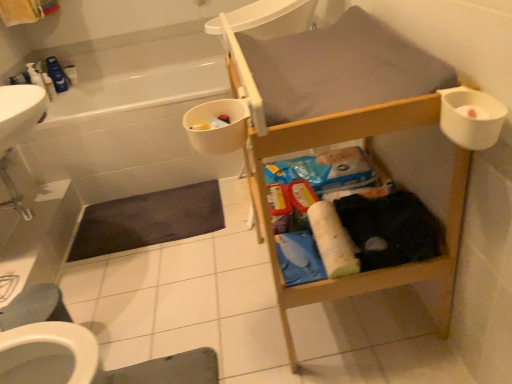
Find the location of a particular element. The height and width of the screenshot is (384, 512). gray fabric bath mat at lower center, which is the first bath mat in front-to-back order is located at coordinates (168, 370).

What do you see at coordinates (57, 74) in the screenshot?
I see `blue glossy bottle at upper left` at bounding box center [57, 74].

Where is `gray fabric bath mat at lower center, the 1th bath mat positioned from the bottom`? This screenshot has height=384, width=512. gray fabric bath mat at lower center, the 1th bath mat positioned from the bottom is located at coordinates (168, 370).

Which is behind, point (346, 241) or point (15, 343)?

Point (346, 241)

Is white matte toilet paper at center to the right of white plastic bidet at lower left from the viewer's perspective?

Indeed, white matte toilet paper at center is positioned on the right side of white plastic bidet at lower left.

Is white matte toilet paper at center smaller than white plastic bidet at lower left?

Yes.

Is white matte toilet paper at center positioned far away from white plastic bidet at lower left?

No, white matte toilet paper at center is in close proximity to white plastic bidet at lower left.

From a real-world perspective, is white plastic container at upper left, positioned as the 2th toiletry in right-to-left order, located beneath white matte toilet paper at center?

Actually, white plastic container at upper left, positioned as the 2th toiletry in right-to-left order, is physically above white matte toilet paper at center in the real world.

Between white plastic container at upper left, the third toiletry when ordered from bottom to top, and white matte toilet paper at center, which one appears on the right side from the viewer's perspective?

From the viewer's perspective, white matte toilet paper at center appears more on the right side.

Which point is more distant from viewer, (70, 77) or (344, 272)?

The point (70, 77) is behind.

In the image, there is a white plastic bidet at lower left. Identify the location of cleaning product above it (from the image's perspective). (57, 74).

Which is in front, point (97, 353) or point (51, 72)?

The point (97, 353) is more forward.

Is white plastic bidet at lower left far away from blue glossy bottle at upper left?

That's right, there is a large distance between white plastic bidet at lower left and blue glossy bottle at upper left.

Is white plastic bidet at lower left far from white plastic container at upper left, acting as the first toiletry starting from the top?

Yes, white plastic bidet at lower left and white plastic container at upper left, acting as the first toiletry starting from the top, are quite far apart.

In terms of height, does white plastic bidet at lower left look taller or shorter compared to white plastic container at upper left, positioned as the 2th toiletry in right-to-left order?

Clearly, white plastic bidet at lower left is taller compared to white plastic container at upper left, positioned as the 2th toiletry in right-to-left order.

Does white plastic bidet at lower left turn towards white plastic container at upper left, the third toiletry when ordered from bottom to top?

No, white plastic bidet at lower left is not facing towards white plastic container at upper left, the third toiletry when ordered from bottom to top.

Does white plastic bidet at lower left appear on the right side of white plastic container at upper left, which appears as the third toiletry when viewed from the front?

Indeed, white plastic bidet at lower left is positioned on the right side of white plastic container at upper left, which appears as the third toiletry when viewed from the front.

From a real-world perspective, which object rests below the other?

gray fabric bath mat at lower center, which is the first bath mat in front-to-back order.

Considering the relative positions of gray fabric bath mat at lower center, which is the first bath mat in front-to-back order, and white matte toilet paper at center in the image provided, is gray fabric bath mat at lower center, which is the first bath mat in front-to-back order, to the left or to the right of white matte toilet paper at center?

gray fabric bath mat at lower center, which is the first bath mat in front-to-back order, is to the left of white matte toilet paper at center.

What's the angular difference between gray fabric bath mat at lower center, which is the first bath mat in front-to-back order, and white matte toilet paper at center's facing directions?

178 degrees separate the facing orientations of gray fabric bath mat at lower center, which is the first bath mat in front-to-back order, and white matte toilet paper at center.

Is white glossy bathtub at upper left smaller than dark matte bath mat at lower left, the first bath mat when ordered from top to bottom?

No, white glossy bathtub at upper left is not smaller than dark matte bath mat at lower left, the first bath mat when ordered from top to bottom.

Is white glossy bathtub at upper left facing away from dark matte bath mat at lower left, the 2th bath mat when ordered from front to back?

No, white glossy bathtub at upper left's orientation is not away from dark matte bath mat at lower left, the 2th bath mat when ordered from front to back.

Consider the image. How different are the orientations of white glossy bathtub at upper left and dark matte bath mat at lower left, the 1th bath mat in the back-to-front sequence, in degrees?

The angle between the facing direction of white glossy bathtub at upper left and the facing direction of dark matte bath mat at lower left, the 1th bath mat in the back-to-front sequence, is 2.89 degrees.

Is white glossy bathtub at upper left next to dark matte bath mat at lower left, the first bath mat when ordered from top to bottom, and touching it?

white glossy bathtub at upper left and dark matte bath mat at lower left, the first bath mat when ordered from top to bottom, are not in contact.

Who is more distant, gray fabric bath mat at lower center, which is the 2th bath mat from top to bottom, or white plastic cup at upper right?

gray fabric bath mat at lower center, which is the 2th bath mat from top to bottom, is more distant.

This screenshot has height=384, width=512. Identify the location of basin above the gray fabric bath mat at lower center, which is the first bath mat in front-to-back order (from the image's perspective). (471, 117).

From a real-world perspective, is gray fabric bath mat at lower center, which is the first bath mat in front-to-back order, positioned above or below white plastic cup at upper right?

gray fabric bath mat at lower center, which is the first bath mat in front-to-back order, is situated lower than white plastic cup at upper right in the real world.

How different are the orientations of gray fabric bath mat at lower center, placed as the second bath mat when sorted from back to front, and white plastic cup at upper right in degrees?

The angular difference between gray fabric bath mat at lower center, placed as the second bath mat when sorted from back to front, and white plastic cup at upper right is 177 degrees.

The height and width of the screenshot is (384, 512). What are the coordinates of `toilet paper above the white plastic bidet at lower left (from the image's perspective)` in the screenshot? It's located at (332, 240).

The image size is (512, 384). Find the location of `the 3rd toiletry behind the white matte toilet paper at center`. the 3rd toiletry behind the white matte toilet paper at center is located at coordinates tap(69, 69).

When comparing their distances from white plastic container at upper left, which appears as the third toiletry when viewed from the front, does white matte toilet paper at center or white plastic cup at upper right seem further?

The object further to white plastic container at upper left, which appears as the third toiletry when viewed from the front, is white plastic cup at upper right.

Considering their positions, is white plastic bidet at lower left positioned closer to white glossy bathtub at upper left than white plastic container at upper left, acting as the first toiletry starting from the top?

Based on the image, white plastic container at upper left, acting as the first toiletry starting from the top, appears to be nearer to white glossy bathtub at upper left.

Based on their spatial positions, is dark matte bath mat at lower left, which appears as the second bath mat when ordered from the bottom, or matte plastic toiletries at center, marked as the third toiletry in a top-to-bottom arrangement, further from blue glossy bottle at upper left?

matte plastic toiletries at center, marked as the third toiletry in a top-to-bottom arrangement, is positioned further to the anchor blue glossy bottle at upper left.

From the image, which object appears to be farther from dark matte bath mat at lower left, the first bath mat when ordered from top to bottom, gray fabric bath mat at lower center, the 1th bath mat positioned from the bottom, or blue glossy bottle at upper left?

Based on the image, blue glossy bottle at upper left appears to be further to dark matte bath mat at lower left, the first bath mat when ordered from top to bottom.

Considering their positions, is white glossy bathtub at upper left positioned closer to blue plastic container at upper left, positioned as the 2th toiletry in bottom-to-top order, than white plastic container at upper left, the 2th toiletry when ordered from left to right?

white plastic container at upper left, the 2th toiletry when ordered from left to right, is closer to blue plastic container at upper left, positioned as the 2th toiletry in bottom-to-top order.

Based on their spatial positions, is white plastic container at upper left, the 2th toiletry when ordered from left to right, or gray fabric bath mat at lower center, which is the first bath mat in front-to-back order, closer to white plastic bidet at lower left?

Among the two, gray fabric bath mat at lower center, which is the first bath mat in front-to-back order, is located nearer to white plastic bidet at lower left.

Based on their spatial positions, is blue glossy bottle at upper left or white glossy bathtub at upper left closer to white matte toilet paper at center?

Among the two, white glossy bathtub at upper left is located nearer to white matte toilet paper at center.

Looking at the image, which one is located closer to gray fabric bath mat at lower center, the 1th bath mat positioned from the bottom, white matte toilet paper at center or white plastic bidet at lower left?

white plastic bidet at lower left lies closer to gray fabric bath mat at lower center, the 1th bath mat positioned from the bottom, than the other object.

Locate an element on the screen. toilet paper between white plastic cup at upper right and dark matte bath mat at lower left, the 1th bath mat in the back-to-front sequence, in the front-back direction is located at coordinates (332, 240).

This screenshot has width=512, height=384. What are the coordinates of `toiletry between blue plastic container at upper left, which is the second toiletry from front to back, and matte plastic toiletries at center, which appears as the 3th toiletry when viewed from the back` in the screenshot? It's located at tap(69, 69).

Locate an element on the screen. The width and height of the screenshot is (512, 384). bath that lies between blue glossy bottle at upper left and white plastic bidet at lower left from top to bottom is located at coordinates (129, 125).

Locate an element on the screen. The width and height of the screenshot is (512, 384). bath mat located between blue plastic container at upper left, which appears as the 1th toiletry when viewed from the left, and white glossy bathtub at upper left in the left-right direction is located at coordinates (148, 220).